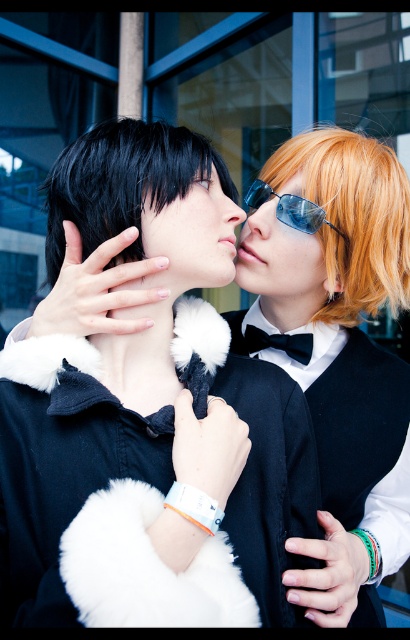
Is shiny orange hair at upper right bigger than black matte forehead at upper center?

Correct, shiny orange hair at upper right is larger in size than black matte forehead at upper center.

Between shiny orange hair at upper right and black matte forehead at upper center, which one has less height?

Standing shorter between the two is black matte forehead at upper center.

Is point (332, 147) closer to camera compared to point (193, 160)?

No, it is not.

Where is `shiny orange hair at upper right`? The image size is (410, 640). shiny orange hair at upper right is located at coordinates (352, 216).

Who is taller, shiny orange hair at upper right or black matte hair at upper center?

shiny orange hair at upper right

Is shiny orange hair at upper right shorter than black matte hair at upper center?

Incorrect, shiny orange hair at upper right's height does not fall short of black matte hair at upper center's.

What do you see at coordinates (352, 216) in the screenshot? This screenshot has height=640, width=410. I see `shiny orange hair at upper right` at bounding box center [352, 216].

This screenshot has width=410, height=640. What are the coordinates of `shiny orange hair at upper right` in the screenshot? It's located at pyautogui.click(x=352, y=216).

Is point (211, 200) positioned in front of point (152, 180)?

No.

Can you confirm if matte black fur collar at center is taller than black matte forehead at upper center?

Yes.

Between point (143, 204) and point (207, 180), which one is positioned in front?

Positioned in front is point (143, 204).

This screenshot has width=410, height=640. What are the coordinates of `matte black fur collar at center` in the screenshot? It's located at (193, 236).